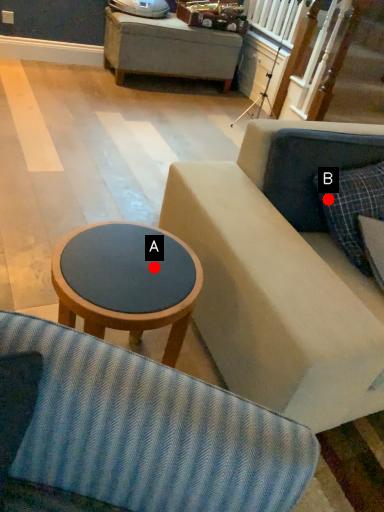
Question: Two points are circled on the image, labeled by A and B beside each circle. Which point is farther to the camera?

Choices:
 (A) A is further
 (B) B is further

Answer: (B)